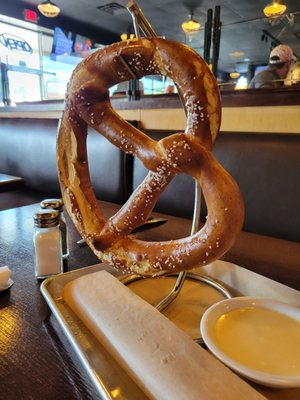
The image size is (300, 400). Identify the location of pepper shaker. (x=64, y=228).